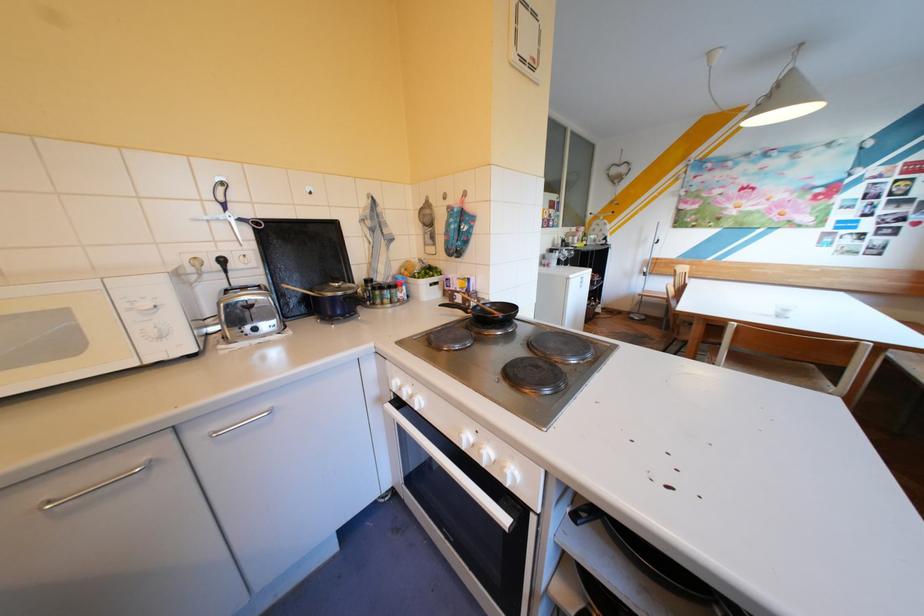
What do you see at coordinates (148, 294) in the screenshot?
I see `a white microwave dial` at bounding box center [148, 294].